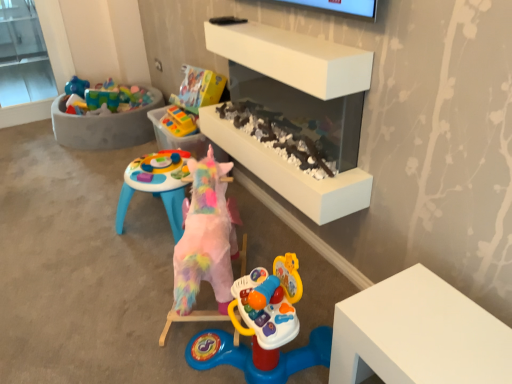
Question: Is fuzzy pink unicorn at center, positioned as the 1th toy in front-to-back order, behind rubberized plastic toy at center, which is the first toy in back-to-front order?

Choices:
 (A) no
 (B) yes

Answer: (A)

Question: Is fuzzy pink unicorn at center, positioned as the 1th toy in front-to-back order, oriented towards rubberized plastic toy at center, the second toy positioned from the front?

Choices:
 (A) yes
 (B) no

Answer: (B)

Question: Is fuzzy pink unicorn at center, which is the second toy in back-to-front order, closer to camera compared to rubberized plastic toy at center, which is the first toy in back-to-front order?

Choices:
 (A) no
 (B) yes

Answer: (B)

Question: From the image's perspective, is fuzzy pink unicorn at center, the 2th toy when ordered from top to bottom, below rubberized plastic toy at center, which is the second toy from bottom to top?

Choices:
 (A) no
 (B) yes

Answer: (B)

Question: Would you consider fuzzy pink unicorn at center, which is the second toy in back-to-front order, to be distant from rubberized plastic toy at center, the second toy positioned from the front?

Choices:
 (A) no
 (B) yes

Answer: (A)

Question: Is concrete tub at upper left in front of or behind rubberized plastic toy at center, the second toy positioned from the front, in the image?

Choices:
 (A) front
 (B) behind

Answer: (B)

Question: Based on their positions, is concrete tub at upper left located to the left or right of rubberized plastic toy at center, which is the first toy in back-to-front order?

Choices:
 (A) left
 (B) right

Answer: (A)

Question: From a real-world perspective, is concrete tub at upper left above or below rubberized plastic toy at center, which is the first toy in back-to-front order?

Choices:
 (A) above
 (B) below

Answer: (B)

Question: Considering the positions of point (x=129, y=142) and point (x=163, y=122), is point (x=129, y=142) closer or farther from the camera than point (x=163, y=122)?

Choices:
 (A) farther
 (B) closer

Answer: (A)

Question: From a real-world perspective, is concrete tub at upper left positioned above or below white matte fireplace at center?

Choices:
 (A) above
 (B) below

Answer: (B)

Question: Considering their positions, is concrete tub at upper left located in front of or behind white matte fireplace at center?

Choices:
 (A) behind
 (B) front

Answer: (A)

Question: Is point (91, 132) positioned closer to the camera than point (336, 66)?

Choices:
 (A) closer
 (B) farther

Answer: (B)

Question: Choose the correct answer: Is concrete tub at upper left inside white matte fireplace at center or outside it?

Choices:
 (A) inside
 (B) outside

Answer: (B)

Question: From the image's perspective, relative to concrete tub at upper left, is white matte fireplace at center above or below?

Choices:
 (A) above
 (B) below

Answer: (B)

Question: Is white matte fireplace at center in front of or behind concrete tub at upper left in the image?

Choices:
 (A) behind
 (B) front

Answer: (B)